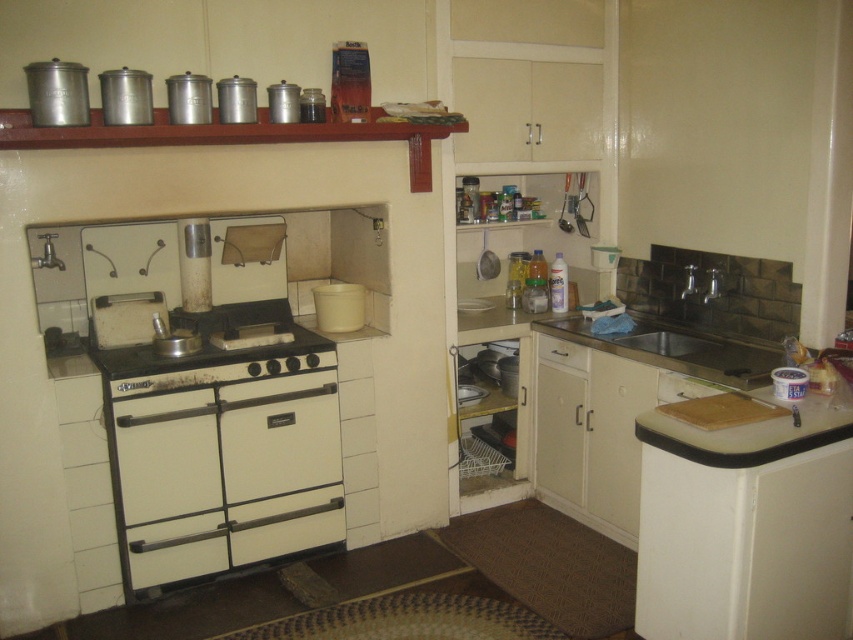
From the picture: You are organizing the kitchen and need to place a new appliance between the white matte oven at center and the stainless steel sink at lower right. Based on their positions, which side of the oven should the appliance be placed to ensure it is between them?

The white matte oven at center is to the left of the stainless steel sink at lower right, so placing the appliance to the right side of the oven would position it between them.

You are a chef preparing to clean the oven and need to reach the white matte oven at center. Is the metallic silver exhaust hood at upper center in the way?

The white matte oven at center is located below the metallic silver exhaust hood at upper center, so the exhaust hood is directly above the oven. This means the metallic silver exhaust hood at upper center would block access to the oven from above, but since the oven is below, you can still reach it from the front or sides without obstruction from the hood.